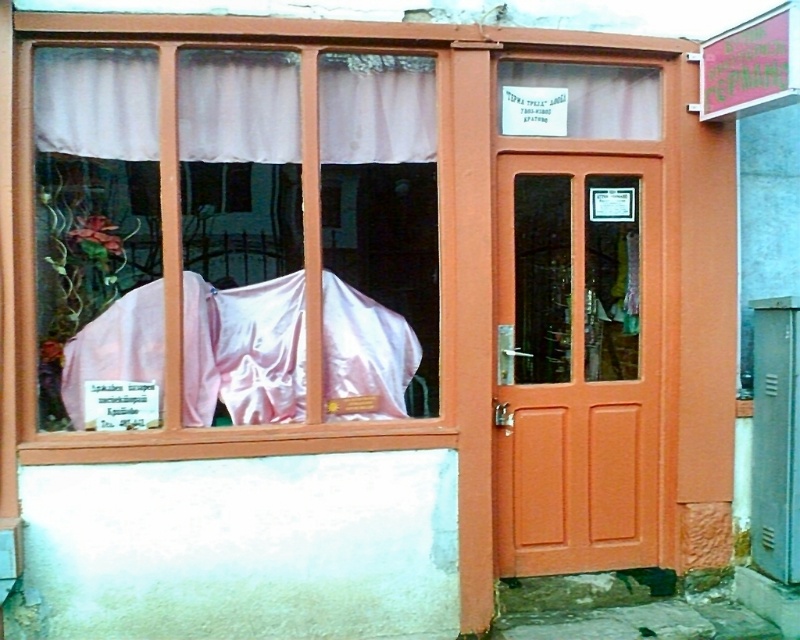
Who is more forward, (112,364) or (574,179)?

Point (112,364) is more forward.

Which of these two, pink satin cloth at left or orange matte door at center, stands shorter?

pink satin cloth at left

Between point (182, 109) and point (649, 541), which one is positioned in front?

Point (182, 109) is more forward.

At what (x,y) coordinates should I click in order to perform the action: click on pink satin cloth at left. Please return your answer as a coordinate pair (x, y). Looking at the image, I should click on (234, 237).

Identify the location of orange matte door at center. The height and width of the screenshot is (640, 800). (578, 364).

Who is more forward, (512, 504) or (180, 77)?

Point (180, 77)

At what (x,y) coordinates should I click in order to perform the action: click on orange matte door at center. Please return your answer as a coordinate pair (x, y). The height and width of the screenshot is (640, 800). Looking at the image, I should click on (578, 364).

Which of these two, white sheer curtain at upper left or pink fabric at center, stands shorter?

white sheer curtain at upper left

This screenshot has height=640, width=800. I want to click on white sheer curtain at upper left, so click(x=238, y=106).